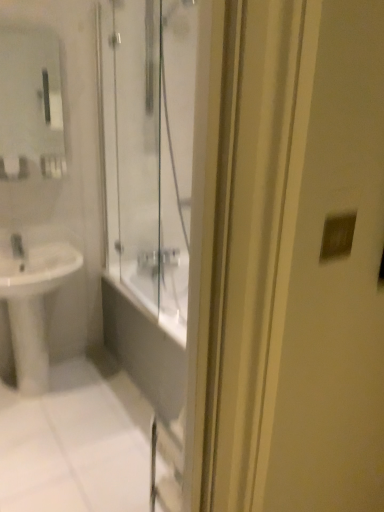
What do you see at coordinates (337, 236) in the screenshot? This screenshot has height=512, width=384. I see `matte silver switch at upper right` at bounding box center [337, 236].

Where is `matte silver switch at upper right`? matte silver switch at upper right is located at coordinates (337, 236).

From a real-world perspective, which is physically below, white glossy sink at lower left or matte glass mirror at upper left?

In real-world perspective, white glossy sink at lower left is lower.

Which of these two, white glossy sink at lower left or matte glass mirror at upper left, is smaller?

matte glass mirror at upper left is smaller.

Considering the sizes of white glossy sink at lower left and matte glass mirror at upper left in the image, is white glossy sink at lower left taller or shorter than matte glass mirror at upper left?

Considering their sizes, white glossy sink at lower left has more height than matte glass mirror at upper left.

Is point (66, 261) farther from camera compared to point (43, 56)?

No, (66, 261) is in front of (43, 56).

From a real-world perspective, does matte glass mirror at upper left stand above white glossy sink at lower left?

Yes, from a real-world perspective, matte glass mirror at upper left is above white glossy sink at lower left.

What are the coordinates of `sink below the matte glass mirror at upper left (from the image's perspective)` in the screenshot? It's located at click(33, 295).

Considering the points (55, 135) and (42, 308), which point is in front, point (55, 135) or point (42, 308)?

The point (42, 308) is closer.

Between matte silver switch at upper right and matte glass mirror at upper left, which one has larger width?

matte glass mirror at upper left.

Is matte silver switch at upper right with matte glass mirror at upper left?

No, matte silver switch at upper right is not making contact with matte glass mirror at upper left.

There is a matte silver switch at upper right. Find the location of `mirror above it (from a real-world perspective)`. mirror above it (from a real-world perspective) is located at coordinates (30, 125).

From the picture: Is matte silver switch at upper right smaller than matte glass mirror at upper left?

Yes, matte silver switch at upper right is smaller than matte glass mirror at upper left.

Considering the positions of point (5, 121) and point (346, 237), is point (5, 121) closer or farther from the camera than point (346, 237)?

Clearly, point (5, 121) is more distant from the camera than point (346, 237).

Locate an element on the screen. Image resolution: width=384 pixels, height=512 pixels. light switch in front of the matte glass mirror at upper left is located at coordinates 337,236.

Is matte glass mirror at upper left inside or outside of matte silver switch at upper right?

→ matte glass mirror at upper left is located beyond the bounds of matte silver switch at upper right.

Looking at their sizes, would you say matte glass mirror at upper left is wider or thinner than matte silver switch at upper right?

Clearly, matte glass mirror at upper left has more width compared to matte silver switch at upper right.

Can you confirm if white glossy sink at lower left is smaller than matte silver switch at upper right?

No.

Is point (30, 311) farther from camera compared to point (326, 255)?

Yes.

From a real-world perspective, is white glossy sink at lower left above or below matte silver switch at upper right?

In terms of real-world spatial position, white glossy sink at lower left is below matte silver switch at upper right.

Who is more distant, white glossy sink at lower left or matte silver switch at upper right?

white glossy sink at lower left is more distant.

Is point (324, 240) positioned after point (19, 289)?

That is False.

Does matte silver switch at upper right turn towards white glossy sink at lower left?

No, matte silver switch at upper right is not oriented towards white glossy sink at lower left.

Does matte silver switch at upper right have a larger size compared to white glossy sink at lower left?

Actually, matte silver switch at upper right might be smaller than white glossy sink at lower left.

What's the angular difference between matte silver switch at upper right and white glossy sink at lower left's facing directions?

matte silver switch at upper right and white glossy sink at lower left are facing 2.81 degrees away from each other.

Identify the location of sink below the matte glass mirror at upper left (from a real-world perspective). This screenshot has height=512, width=384. (33, 295).

Where is `mirror on the right of white glossy sink at lower left`? Image resolution: width=384 pixels, height=512 pixels. mirror on the right of white glossy sink at lower left is located at coordinates (30, 125).

Estimate the real-world distances between objects in this image. Which object is further from matte silver switch at upper right, matte glass mirror at upper left or white glossy sink at lower left?

Based on the image, matte glass mirror at upper left appears to be further to matte silver switch at upper right.

When comparing their distances from matte glass mirror at upper left, does white glossy sink at lower left or matte silver switch at upper right seem further?

The object further to matte glass mirror at upper left is matte silver switch at upper right.

From the image, which object appears to be nearer to matte glass mirror at upper left, matte silver switch at upper right or white glossy sink at lower left?

white glossy sink at lower left lies closer to matte glass mirror at upper left than the other object.

In the scene shown: Considering their positions, is matte silver switch at upper right positioned further to white glossy sink at lower left than matte glass mirror at upper left?

The object further to white glossy sink at lower left is matte silver switch at upper right.

Based on their spatial positions, is matte glass mirror at upper left or matte silver switch at upper right further from white glossy sink at lower left?

matte silver switch at upper right lies further to white glossy sink at lower left than the other object.

From the image, which object appears to be farther from matte silver switch at upper right, white glossy sink at lower left or matte glass mirror at upper left?

The object further to matte silver switch at upper right is matte glass mirror at upper left.

Where is `sink between matte silver switch at upper right and matte glass mirror at upper left from front to back`? Image resolution: width=384 pixels, height=512 pixels. sink between matte silver switch at upper right and matte glass mirror at upper left from front to back is located at coordinates (33, 295).